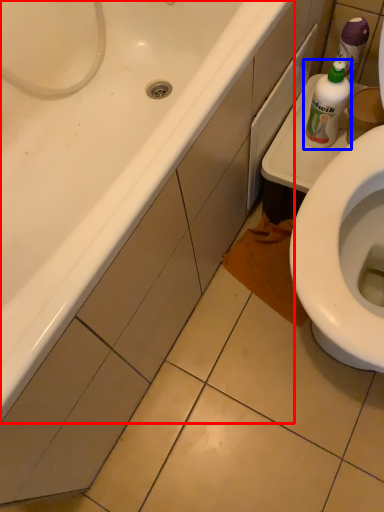
Question: Which object is closer to the camera taking this photo, bathtub (highlighted by a red box) or bottle (highlighted by a blue box)?

Choices:
 (A) bathtub
 (B) bottle

Answer: (A)